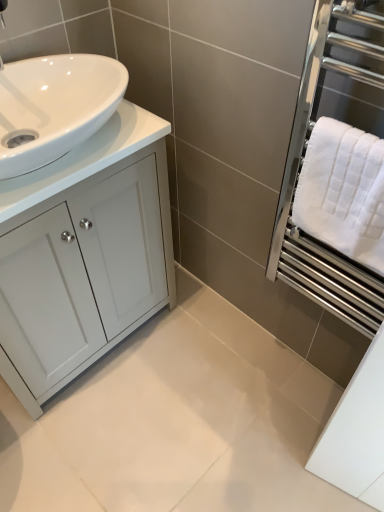
Question: Does white glossy countertop at left contain white textured towel at right?

Choices:
 (A) no
 (B) yes

Answer: (A)

Question: Is white glossy countertop at left far from white textured towel at right?

Choices:
 (A) yes
 (B) no

Answer: (B)

Question: From a real-world perspective, is white glossy countertop at left under white textured towel at right?

Choices:
 (A) yes
 (B) no

Answer: (B)

Question: Is the depth of white glossy countertop at left less than that of white textured towel at right?

Choices:
 (A) yes
 (B) no

Answer: (B)

Question: Is the position of white glossy countertop at left more distant than that of white textured towel at right?

Choices:
 (A) no
 (B) yes

Answer: (B)

Question: Considering the relative sizes of white glossy countertop at left and white textured towel at right in the image provided, is white glossy countertop at left taller than white textured towel at right?

Choices:
 (A) yes
 (B) no

Answer: (B)

Question: Does white glossy cabinet at left turn towards white textured towel at right?

Choices:
 (A) no
 (B) yes

Answer: (B)

Question: Is white glossy cabinet at left behind white textured towel at right?

Choices:
 (A) no
 (B) yes

Answer: (B)

Question: From the image's perspective, would you say white glossy cabinet at left is positioned over white textured towel at right?

Choices:
 (A) yes
 (B) no

Answer: (B)

Question: Is white glossy cabinet at left positioned beyond the bounds of white textured towel at right?

Choices:
 (A) yes
 (B) no

Answer: (A)

Question: Is there a large distance between white glossy cabinet at left and white textured towel at right?

Choices:
 (A) yes
 (B) no

Answer: (B)

Question: Considering the relative sizes of white glossy cabinet at left and white textured towel at right in the image provided, is white glossy cabinet at left bigger than white textured towel at right?

Choices:
 (A) yes
 (B) no

Answer: (A)

Question: Are white textured towel at right and white glossy countertop at left far apart?

Choices:
 (A) yes
 (B) no

Answer: (B)